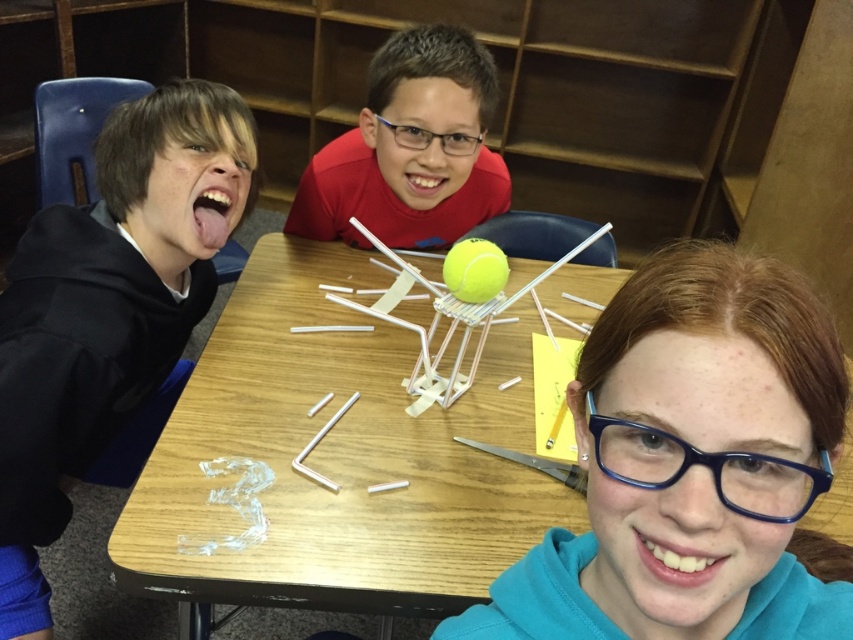
What is the 2D coordinate of the wooden table at center?

The wooden table at center is located at the 2D coordinate point of (338, 458).

You are a teacher observing the children working on their project. You need to move a tool from the black hoodie at left to the wooden table at center. In which direction should you move the tool?

The wooden table at center is to the right of the black hoodie at left, so you should move the tool to the right.